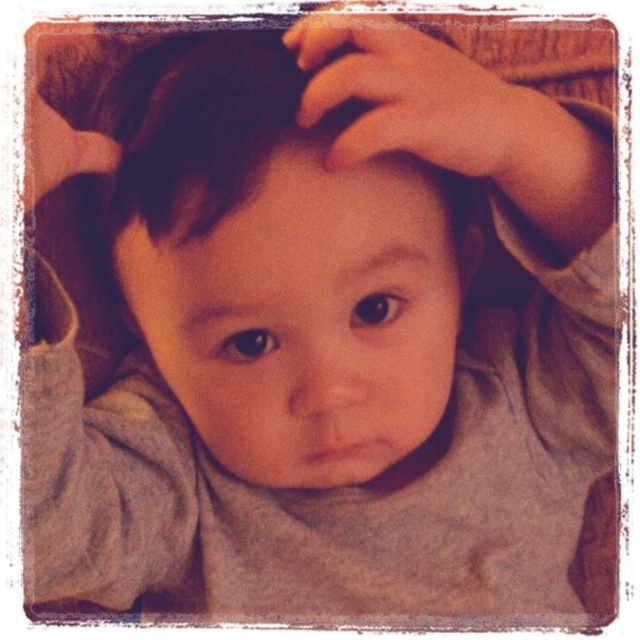
Question: In this image, where is dark brown silky hair at center located relative to smooth skin hand at upper center?

Choices:
 (A) right
 (B) left

Answer: (B)

Question: Which object is farther from the camera taking this photo?

Choices:
 (A) smooth skin hand at upper center
 (B) dark brown silky hair at center

Answer: (B)

Question: Can you confirm if dark brown silky hair at center is positioned to the left of smooth skin hand at upper center?

Choices:
 (A) yes
 (B) no

Answer: (A)

Question: Does dark brown silky hair at center have a larger size compared to smooth skin hand at upper center?

Choices:
 (A) no
 (B) yes

Answer: (B)

Question: Which point is closer to the camera taking this photo?

Choices:
 (A) (163, 83)
 (B) (460, 77)

Answer: (B)